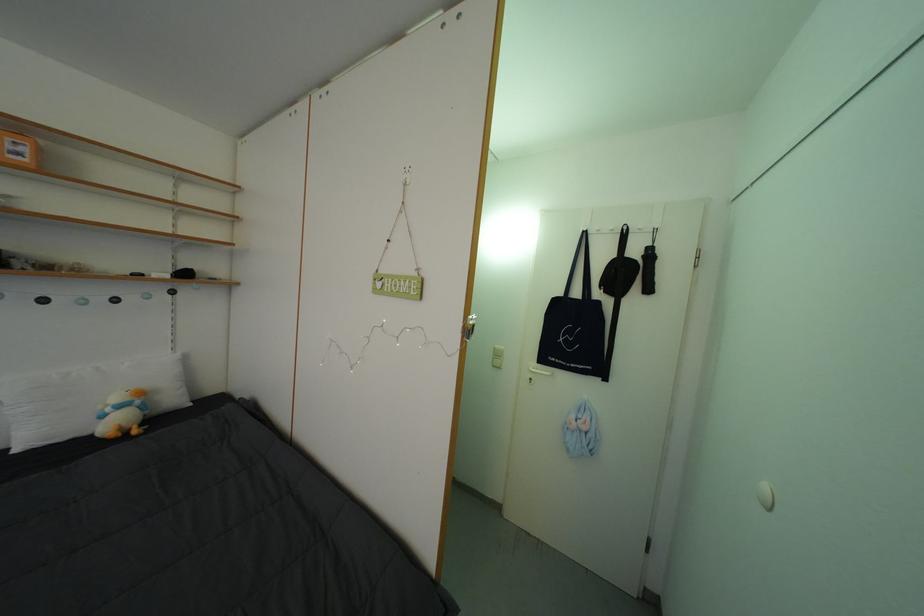
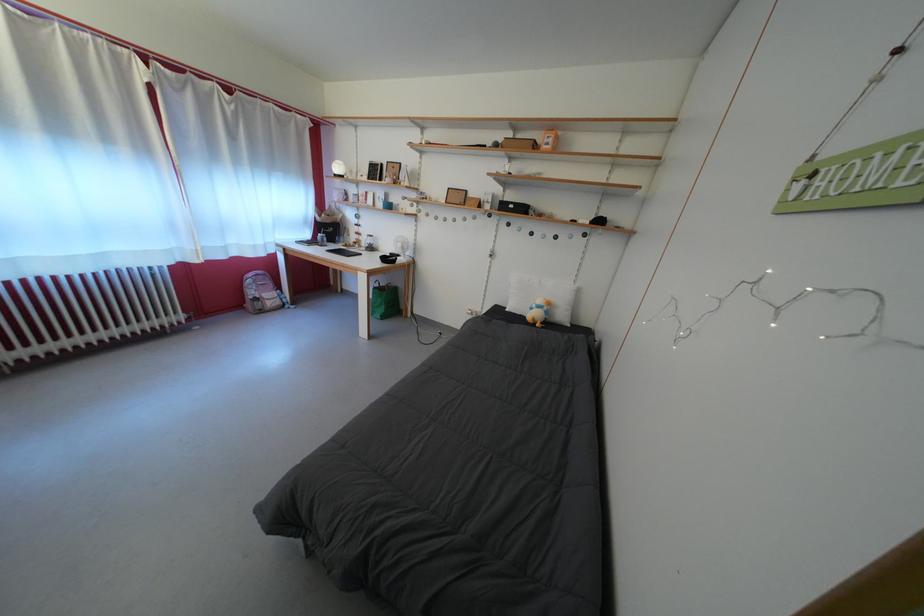
Where in the second image is the point corresponding to [117,415] from the first image?

(542, 312)